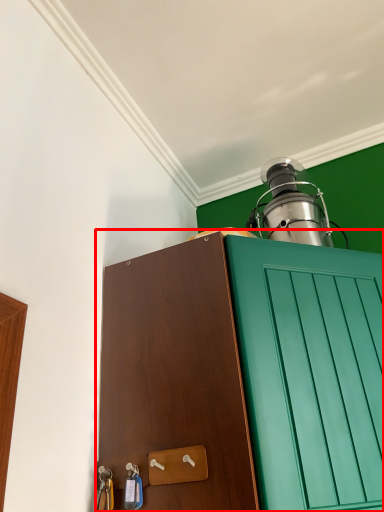
Question: From the image's perspective, what is the correct spatial relationship of cabinetry (annotated by the red box) in relation to oil lamp?

Choices:
 (A) below
 (B) above

Answer: (A)